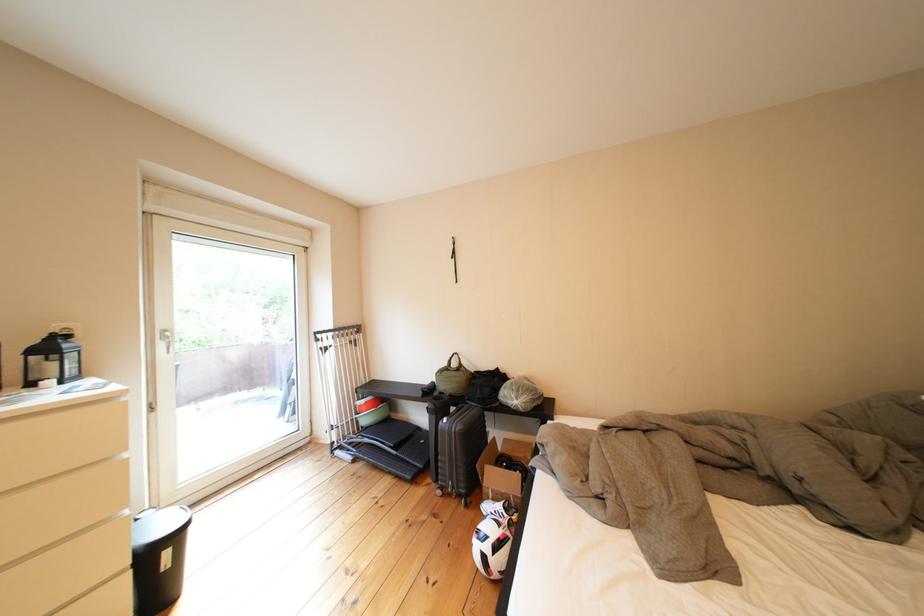
What do you see at coordinates (463, 360) in the screenshot? I see `the green bag handle` at bounding box center [463, 360].